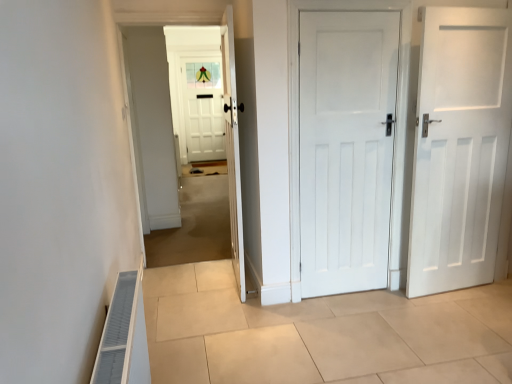
You are a GUI agent. You are given a task and a screenshot of the screen. Output one action in this format:
    pyautogui.click(x=<x>, y=<y>)
    Task: Click on the free space on the front side of white painted wood door at center, the second door when ordered from right to left
    
    Given the screenshot: What is the action you would take?
    pyautogui.click(x=358, y=319)